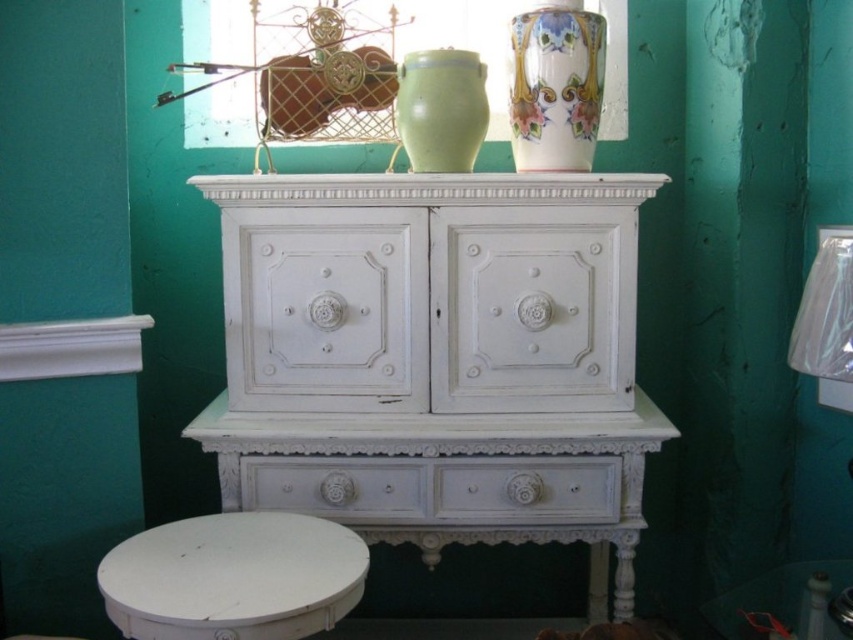
You are standing in front of the vintage cabinet. There is a porcelain vase at upper right on the cabinet. Can you reach it without moving any other items?

The porcelain vase at upper right is 1.76 meters from the viewer, which is beyond typical human arm reach. You cannot reach it without moving other items.

You are arranging items on a shelf and need to know the height of the objects. Which one is shorter between the white painted wood drawer at center and the matte ceramic vase at upper center?

The white painted wood drawer at center is not as tall as the matte ceramic vase at upper center, so the white painted wood drawer at center is shorter.

You are standing in front of the vintage white wooden cabinet. You want to reach a point located at coordinates point (561,56). If your arm can extend 1.5 meters, can you reach it?

The distance between point (561,56) and the camera is 1.78 meters. Since your arm can only extend 1.5 meters, you cannot reach it.